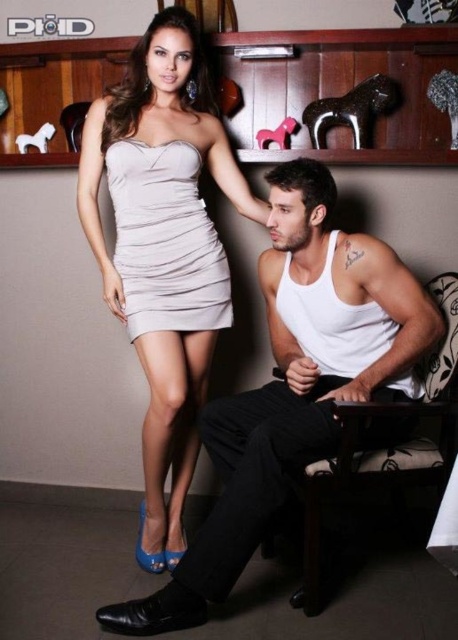
You are a photographer setting up a shoot. You have a 1.2 meter wide backdrop that needs to cover both the white matte tank top at center and the white fabric chair at lower right. Considering their widths, will the backdrop be sufficient?

The white matte tank top at center is wider than the white fabric chair at lower right. Since the backdrop is 1.2 meters wide, it should be sufficient to cover both objects as long as their combined widths do not exceed the backdrop width. However, without exact measurements of each object, we can only confirm the tank top is wider, but the total width requirement isn

In the image, there are two people. The woman is wearing a light gray strapless dress and the man is seated in a chair. There is also a point marked at coordinates point (163, 250). Can you tell me what object is located at that point?

The point (163, 250) corresponds to the satin beige dress at upper left.